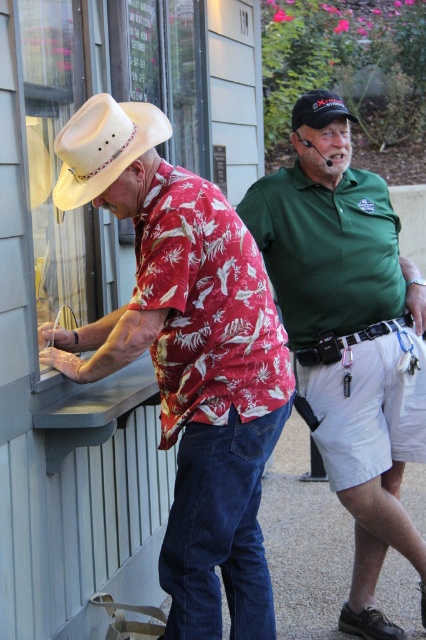
Based on the photo, can you confirm if matte white cowboy hat at left is positioned below green cotton shirt at center?

No.

Can you confirm if matte white cowboy hat at left is positioned to the right of green cotton shirt at center?

Incorrect, matte white cowboy hat at left is not on the right side of green cotton shirt at center.

Is point (63, 154) more distant than point (324, 394)?

No, (63, 154) is closer to viewer.

Identify the location of matte white cowboy hat at left. (186, 356).

Which is above, green cotton shirt at center or black matte cap at upper center?

black matte cap at upper center is above.

Does green cotton shirt at center appear on the left side of black matte cap at upper center?

No, green cotton shirt at center is not to the left of black matte cap at upper center.

Between point (408, 541) and point (327, 104), which one is positioned behind?

The point (408, 541) is behind.

Where is `green cotton shirt at center`? The image size is (426, 640). green cotton shirt at center is located at coordinates (350, 342).

Which is in front, point (169, 134) or point (293, 112)?

Point (169, 134) is more forward.

Image resolution: width=426 pixels, height=640 pixels. What do you see at coordinates (103, 145) in the screenshot?
I see `light brown felt cowboy hat at left` at bounding box center [103, 145].

Find the location of a particular element. light brown felt cowboy hat at left is located at coordinates (103, 145).

The width and height of the screenshot is (426, 640). Find the location of `light brown felt cowboy hat at left`. light brown felt cowboy hat at left is located at coordinates (103, 145).